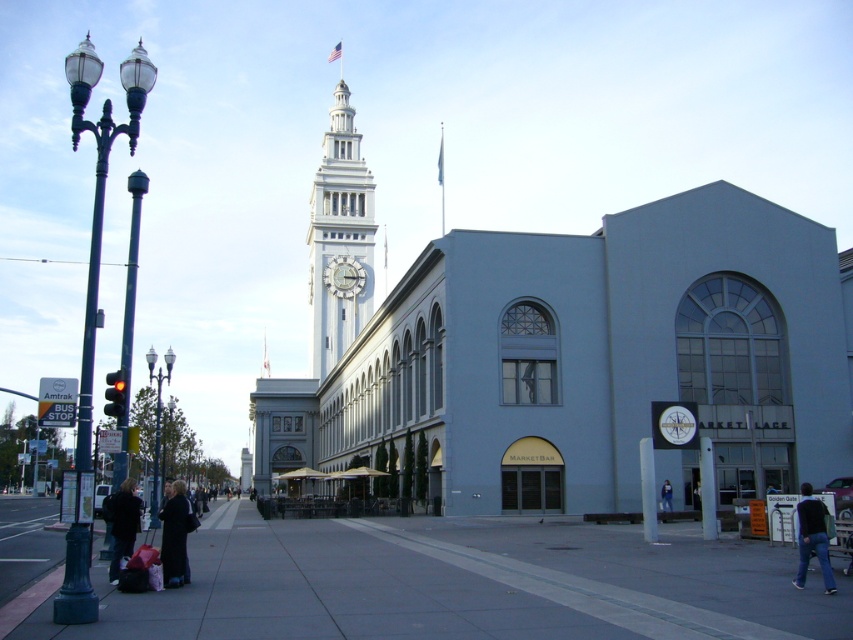
You are a city planner assessing the placement of streetlights for maintenance. You notice the green painted metal streetlight at left and the black glass lamp post at left. Which one requires more space for maintenance access due to its size?

The green painted metal streetlight at left requires more space for maintenance access because it is larger in size than the black glass lamp post at left.

You are a delivery person trying to avoid hitting a pedestrian with your cart. You see the polished metal streetlight at left and the denim jacket at lower right. Which object is taller and needs to be considered for clearance?

The polished metal streetlight at left is much taller than the denim jacket at lower right, so you should consider its height for clearance to avoid hitting pedestrians or the cart getting stuck.